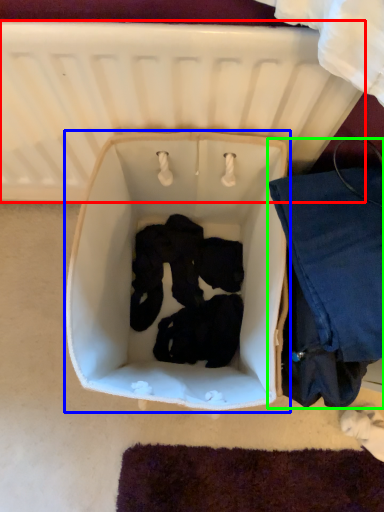
Question: Based on their relative distances, which object is farther from infant bed (highlighted by a red box)? Choose from baby carriage (highlighted by a blue box) and clothing (highlighted by a green box).

Choices:
 (A) baby carriage
 (B) clothing

Answer: (B)